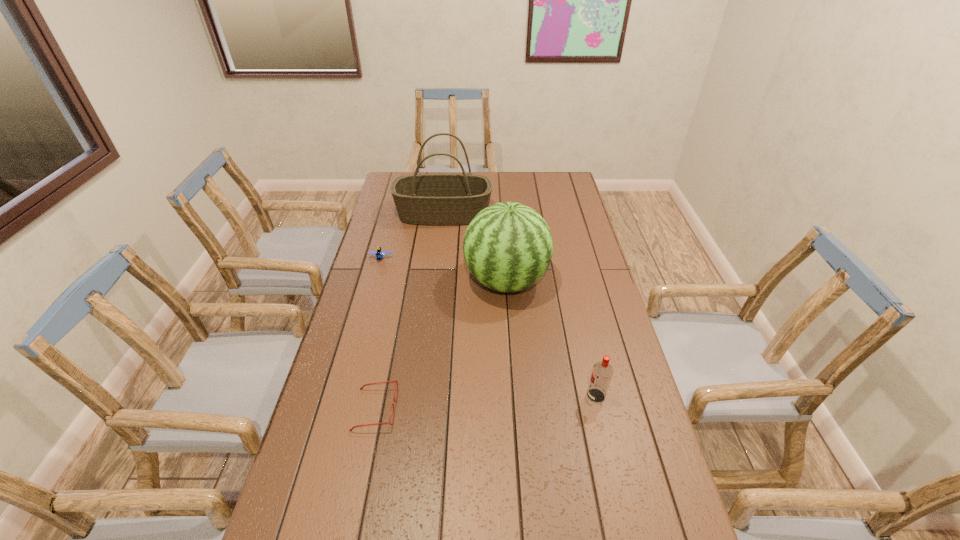
Locate an element on the screen. This screenshot has height=540, width=960. vacant region between the Lego and the farthest object is located at coordinates (412, 236).

The height and width of the screenshot is (540, 960). I want to click on object that is the fourth closest to the watermelon, so click(x=396, y=380).

The height and width of the screenshot is (540, 960). In order to click on object that stands as the fourth closest to the farthest object in this screenshot , I will do `click(602, 372)`.

At what (x,y) coordinates should I click in order to perform the action: click on free location that satisfies the following two spatial constraints: 1. on the front side of the farthest object; 2. on the face of the spectacles. Please return your answer as a coordinate pair (x, y). The image size is (960, 540). Looking at the image, I should click on (420, 409).